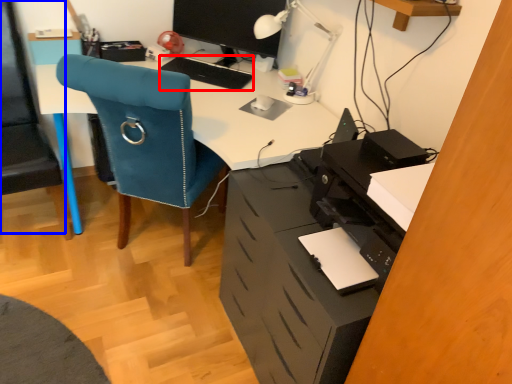
Question: Which point is closer to the camera, keyboard (highlighted by a red box) or computer chair (highlighted by a blue box)?

Choices:
 (A) keyboard
 (B) computer chair

Answer: (B)